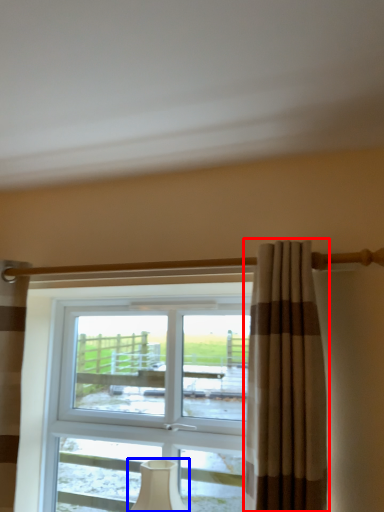
Question: Among these objects, which one is farthest to the camera, curtain (highlighted by a red box) or table lamp (highlighted by a blue box)?

Choices:
 (A) curtain
 (B) table lamp

Answer: (B)